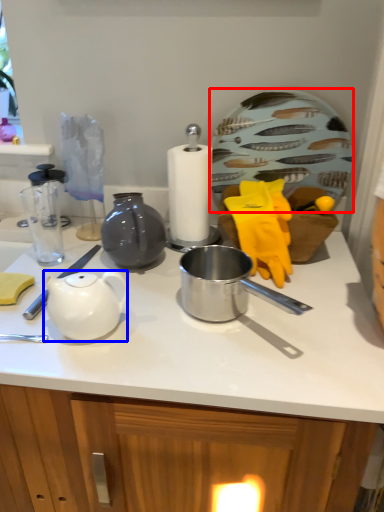
Question: Among these objects, which one is farthest to the camera, plate (highlighted by a red box) or teapot (highlighted by a blue box)?

Choices:
 (A) plate
 (B) teapot

Answer: (A)